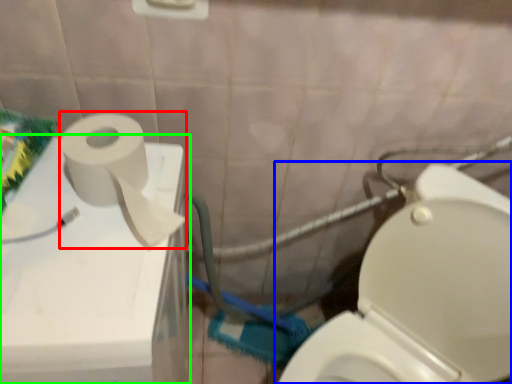
Question: Considering the real-world distances, which object is farthest from toiletry paper (highlighted by a red box)? toilet (highlighted by a blue box) or appliance (highlighted by a green box)?

Choices:
 (A) toilet
 (B) appliance

Answer: (A)